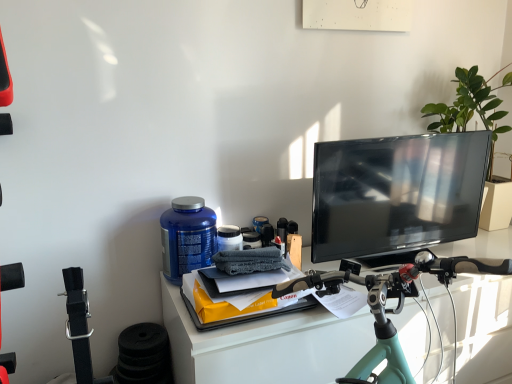
Question: Does teal matte bicycle handlebars at center have a greater height compared to blue plastic bottle at center-left?

Choices:
 (A) no
 (B) yes

Answer: (B)

Question: Is teal matte bicycle handlebars at center further to the viewer compared to blue plastic bottle at center-left?

Choices:
 (A) no
 (B) yes

Answer: (A)

Question: Is teal matte bicycle handlebars at center turned away from blue plastic bottle at center-left?

Choices:
 (A) no
 (B) yes

Answer: (A)

Question: Considering the relative positions of teal matte bicycle handlebars at center and blue plastic bottle at center-left in the image provided, is teal matte bicycle handlebars at center in front of blue plastic bottle at center-left?

Choices:
 (A) no
 (B) yes

Answer: (B)

Question: Can you confirm if teal matte bicycle handlebars at center is thinner than blue plastic bottle at center-left?

Choices:
 (A) no
 (B) yes

Answer: (A)

Question: Is blue plastic bottle at center-left situated inside matte black tv at right or outside?

Choices:
 (A) outside
 (B) inside

Answer: (A)

Question: From a real-world perspective, is blue plastic bottle at center-left positioned above or below matte black tv at right?

Choices:
 (A) above
 (B) below

Answer: (B)

Question: Looking at their shapes, would you say blue plastic bottle at center-left is wider or thinner than matte black tv at right?

Choices:
 (A) thin
 (B) wide

Answer: (B)

Question: Is point (184, 213) positioned closer to the camera than point (395, 145)?

Choices:
 (A) closer
 (B) farther

Answer: (A)

Question: From the image's perspective, relative to green leafy plant at upper right, is matte black tv at right above or below?

Choices:
 (A) above
 (B) below

Answer: (B)

Question: Is point pos(409,162) closer or farther from the camera than point pos(442,124)?

Choices:
 (A) farther
 (B) closer

Answer: (B)

Question: Is matte black tv at right to the left or to the right of green leafy plant at upper right in the image?

Choices:
 (A) right
 (B) left

Answer: (B)

Question: In terms of size, does matte black tv at right appear bigger or smaller than green leafy plant at upper right?

Choices:
 (A) big
 (B) small

Answer: (B)

Question: Is teal matte bicycle handlebars at center inside the boundaries of blue plastic bottle at center-left, or outside?

Choices:
 (A) outside
 (B) inside

Answer: (A)

Question: Is point (459, 261) closer or farther from the camera than point (172, 208)?

Choices:
 (A) closer
 (B) farther

Answer: (A)